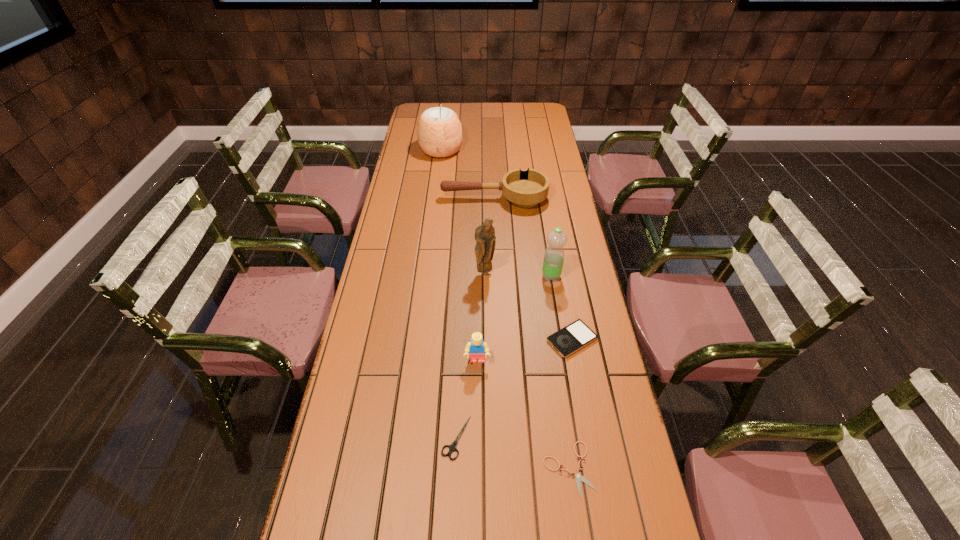
This screenshot has width=960, height=540. I want to click on vacant space located 0.070m on the back of the shortest object, so click(562, 415).

Identify the location of object present at the left edge. This screenshot has width=960, height=540. (439, 131).

This screenshot has width=960, height=540. What are the coordinates of `water bottle that is at the right edge` in the screenshot? It's located at (x=553, y=261).

Image resolution: width=960 pixels, height=540 pixels. Identify the location of saucepan located at the right edge. (525, 189).

The width and height of the screenshot is (960, 540). Identify the location of iPod located at the right edge. (573, 337).

Identify the location of shears at the right edge. This screenshot has width=960, height=540. (578, 476).

This screenshot has height=540, width=960. Find the location of `vacant space at the far edge`. vacant space at the far edge is located at coordinates (516, 123).

Locate an element on the screen. This screenshot has width=960, height=540. free spot at the left edge of the desktop is located at coordinates click(363, 500).

In the image, there is a desktop. At what (x,y) coordinates should I click in order to perform the action: click on vacant space at the right edge. Please return your answer as a coordinate pair (x, y). This screenshot has height=540, width=960. Looking at the image, I should click on (631, 469).

Where is `vacant space at the far right corner of the desktop`? vacant space at the far right corner of the desktop is located at coordinates (538, 105).